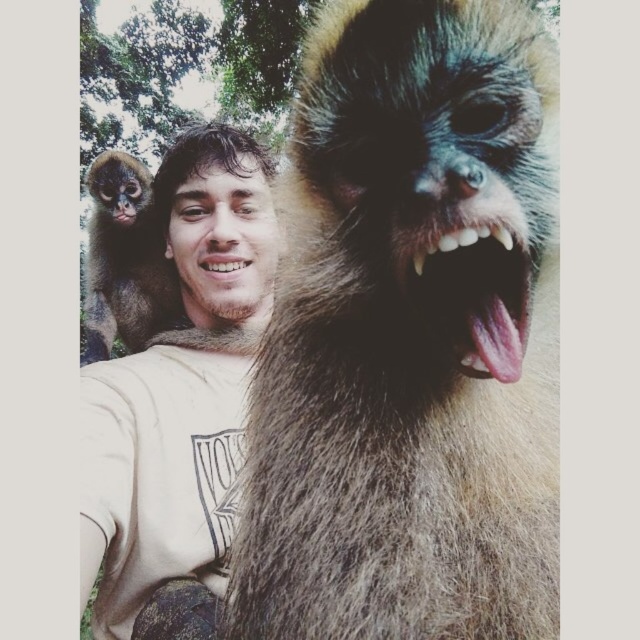
In order to click on fuzzy brown fur monkey at upper left in this screenshot , I will do `click(410, 339)`.

Between fuzzy brown fur monkey at upper left and brown furry monkey at upper left, which one has less height?

fuzzy brown fur monkey at upper left is shorter.

Where is `fuzzy brown fur monkey at upper left`? fuzzy brown fur monkey at upper left is located at coordinates tap(410, 339).

Identify the location of matte white t-shirt at upper left. (179, 362).

Is matte white t-shirt at upper left closer to camera compared to brown furry monkey at upper left?

Yes, it is in front of brown furry monkey at upper left.

At what (x,y) coordinates should I click in order to perform the action: click on matte white t-shirt at upper left. Please return your answer as a coordinate pair (x, y). This screenshot has width=640, height=640. Looking at the image, I should click on pyautogui.click(x=179, y=362).

Identify the location of matte white t-shirt at upper left. The width and height of the screenshot is (640, 640). (179, 362).

Does fuzzy brown fur monkey at upper left have a lesser height compared to matte white t-shirt at upper left?

Yes.

Who is positioned more to the left, fuzzy brown fur monkey at upper left or matte white t-shirt at upper left?

matte white t-shirt at upper left is more to the left.

Find the location of a particular element. The width and height of the screenshot is (640, 640). fuzzy brown fur monkey at upper left is located at coordinates (410, 339).